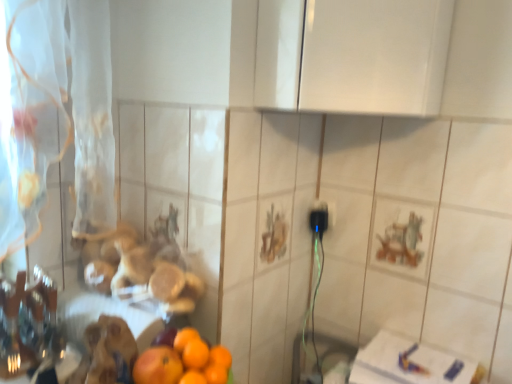
Question: Is white sheer curtain at left at the right side of orange matte at lower left, arranged as the 2th orange when viewed from the right?

Choices:
 (A) no
 (B) yes

Answer: (A)

Question: Is white sheer curtain at left positioned with its back to orange matte at lower left, arranged as the 2th orange when viewed from the right?

Choices:
 (A) no
 (B) yes

Answer: (A)

Question: Can you confirm if white sheer curtain at left is smaller than orange matte at lower left, acting as the 1th orange starting from the left?

Choices:
 (A) yes
 (B) no

Answer: (B)

Question: Considering the relative sizes of white sheer curtain at left and orange matte at lower left, arranged as the 2th orange when viewed from the right, in the image provided, is white sheer curtain at left wider than orange matte at lower left, arranged as the 2th orange when viewed from the right,?

Choices:
 (A) yes
 (B) no

Answer: (A)

Question: Can you confirm if white sheer curtain at left is positioned to the left of orange matte at lower left, arranged as the 2th orange when viewed from the right?

Choices:
 (A) no
 (B) yes

Answer: (B)

Question: Does white sheer curtain at left have a greater height compared to orange matte at lower left, arranged as the 2th orange when viewed from the right?

Choices:
 (A) yes
 (B) no

Answer: (A)

Question: Is orange matte at lower left, the first orange viewed from the right, outside of orange matte at lower left, arranged as the 2th orange when viewed from the right?

Choices:
 (A) yes
 (B) no

Answer: (A)

Question: Considering the relative positions of orange matte at lower left, marked as the second orange in a left-to-right arrangement, and orange matte at lower left, acting as the 1th orange starting from the left, in the image provided, is orange matte at lower left, marked as the second orange in a left-to-right arrangement, to the left of orange matte at lower left, acting as the 1th orange starting from the left, from the viewer's perspective?

Choices:
 (A) no
 (B) yes

Answer: (A)

Question: Is orange matte at lower left, the first orange viewed from the right, placed right next to orange matte at lower left, acting as the 1th orange starting from the left?

Choices:
 (A) yes
 (B) no

Answer: (A)

Question: From the image's perspective, is orange matte at lower left, marked as the second orange in a left-to-right arrangement, on top of orange matte at lower left, arranged as the 2th orange when viewed from the right?

Choices:
 (A) yes
 (B) no

Answer: (A)

Question: From the image's perspective, is orange matte at lower left, the first orange viewed from the right, located beneath orange matte at lower left, acting as the 1th orange starting from the left?

Choices:
 (A) no
 (B) yes

Answer: (A)

Question: Is orange matte at lower left, the first orange viewed from the right, closer to the viewer compared to orange matte at lower left, acting as the 1th orange starting from the left?

Choices:
 (A) yes
 (B) no

Answer: (B)

Question: From the image's perspective, is white sheer curtain at left on top of orange matte at lower left, marked as the second orange in a left-to-right arrangement?

Choices:
 (A) no
 (B) yes

Answer: (B)